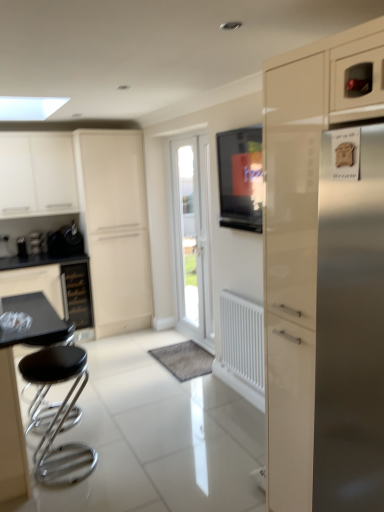
Question: Does matte black tv at center lie in front of white glossy cabinet at upper left, the second cabinetry in the right-to-left sequence?

Choices:
 (A) no
 (B) yes

Answer: (B)

Question: Does matte black tv at center have a lesser height compared to white glossy cabinet at upper left, the second cabinetry in the right-to-left sequence?

Choices:
 (A) yes
 (B) no

Answer: (A)

Question: From the image's perspective, does matte black tv at center appear higher than white glossy cabinet at upper left, marked as the first cabinetry in a left-to-right arrangement?

Choices:
 (A) no
 (B) yes

Answer: (A)

Question: Is matte black tv at center wider than white glossy cabinet at upper left, marked as the first cabinetry in a left-to-right arrangement?

Choices:
 (A) no
 (B) yes

Answer: (A)

Question: Is matte black tv at center facing away from white glossy cabinet at upper left, the second cabinetry in the right-to-left sequence?

Choices:
 (A) yes
 (B) no

Answer: (B)

Question: Is matte black tv at center at the right side of white glossy cabinet at upper left, the 1th cabinetry positioned from the back?

Choices:
 (A) no
 (B) yes

Answer: (B)

Question: Is glossy cream cabinet at right, arranged as the 1th cabinetry when viewed from the right, outside of white glossy cabinet at center?

Choices:
 (A) yes
 (B) no

Answer: (A)

Question: Does glossy cream cabinet at right, arranged as the 1th cabinetry when viewed from the right, have a lesser width compared to white glossy cabinet at center?

Choices:
 (A) no
 (B) yes

Answer: (A)

Question: From a real-world perspective, is glossy cream cabinet at right, which appears as the 2th cabinetry when viewed from the back, located beneath white glossy cabinet at center?

Choices:
 (A) no
 (B) yes

Answer: (B)

Question: Can you confirm if glossy cream cabinet at right, the first cabinetry from the front, is positioned to the right of white glossy cabinet at center?

Choices:
 (A) no
 (B) yes

Answer: (B)

Question: Is white glossy cabinet at center surrounded by glossy cream cabinet at right, arranged as the 1th cabinetry when viewed from the right?

Choices:
 (A) yes
 (B) no

Answer: (B)

Question: Considering the relative sizes of glossy cream cabinet at right, which appears as the 2th cabinetry when viewed from the back, and white glossy cabinet at center in the image provided, is glossy cream cabinet at right, which appears as the 2th cabinetry when viewed from the back, smaller than white glossy cabinet at center?

Choices:
 (A) no
 (B) yes

Answer: (B)

Question: Can you see satin black coffee machine at left touching metallic black kettle at left?

Choices:
 (A) no
 (B) yes

Answer: (A)